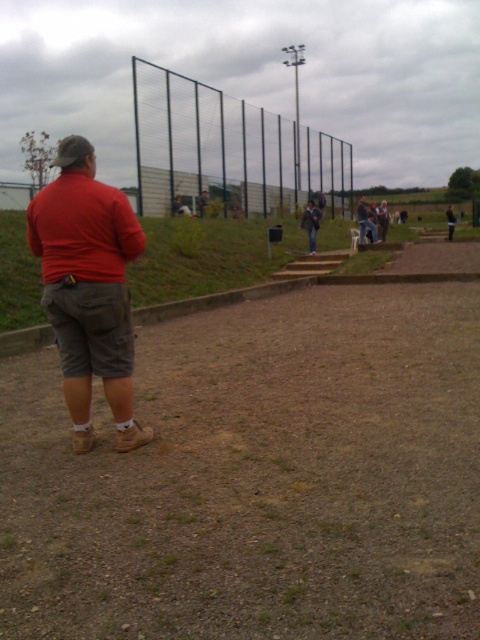
Which is in front, point (81, 612) or point (176, 168)?

Positioned in front is point (81, 612).

Can you confirm if brown gravel dirt track at center is positioned to the right of green wire mesh fence at upper center?

Indeed, brown gravel dirt track at center is positioned on the right side of green wire mesh fence at upper center.

Is point (336, 333) more distant than point (285, 180)?

No, it is not.

Where is `brown gravel dirt track at center`? brown gravel dirt track at center is located at coordinates (257, 476).

Who is shorter, dark gray fabric jacket at center or light brown leather jacket at upper center?

dark gray fabric jacket at center is shorter.

Which is behind, point (310, 253) or point (452, 220)?

The point (452, 220) is behind.

You are a GUI agent. You are given a task and a screenshot of the screen. Output one action in this format:
    pyautogui.click(x=<x>, y=<y>)
    Task: Click on the dark gray fabric jacket at center
    The width and height of the screenshot is (480, 640).
    Given the screenshot: What is the action you would take?
    pyautogui.click(x=311, y=224)

Is green wire mesh fence at upper center further to the viewer compared to light brown leather jacket at upper center?

That is False.

How distant is green wire mesh fence at upper center from light brown leather jacket at upper center?

They are 10.63 meters apart.

The image size is (480, 640). What do you see at coordinates (228, 150) in the screenshot?
I see `green wire mesh fence at upper center` at bounding box center [228, 150].

Find the location of a particular element. green wire mesh fence at upper center is located at coordinates (228, 150).